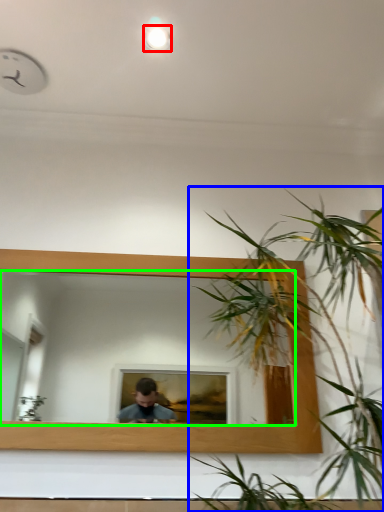
Question: Which object is the closest to the light (highlighted by a red box)? Choose among these: houseplant (highlighted by a blue box) or mirror (highlighted by a green box).

Choices:
 (A) houseplant
 (B) mirror

Answer: (A)